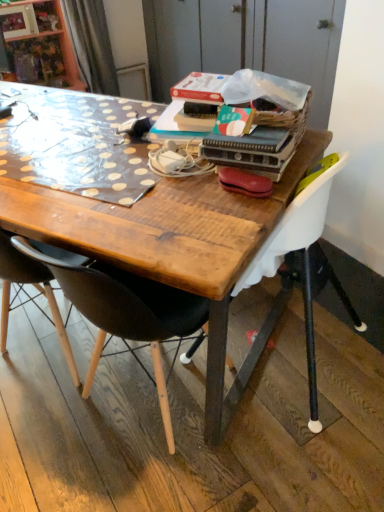
Where is `free space on the front side of black plastic chair at center, which is the first chair from left to right`? Image resolution: width=384 pixels, height=512 pixels. free space on the front side of black plastic chair at center, which is the first chair from left to right is located at coordinates (147, 479).